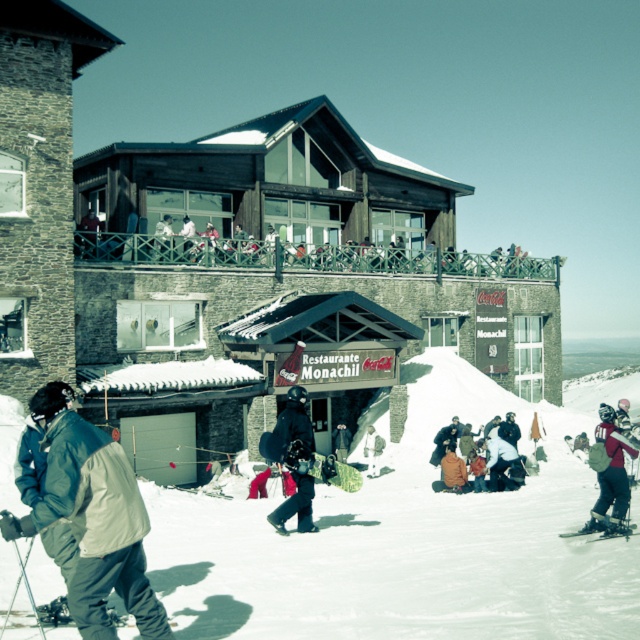
You are standing at the entrance of the ski resort and want to take a photo of the wooden ski resort at center. Where should you position yourself to capture the entire structure in your camera frame?

The wooden ski resort at center is located at point (234, 268), so you should position yourself at a central viewpoint to ensure the entire structure fits within the camera frame.

You are a snowboarder planning to descend a slope and see the white powder snow at center and the matte black snowboarder at center. Which object is closer to you?

The matte black snowboarder at center is closer because the white powder snow at center is 16.31 meters away from it, implying the snowboarder is nearer to your position.